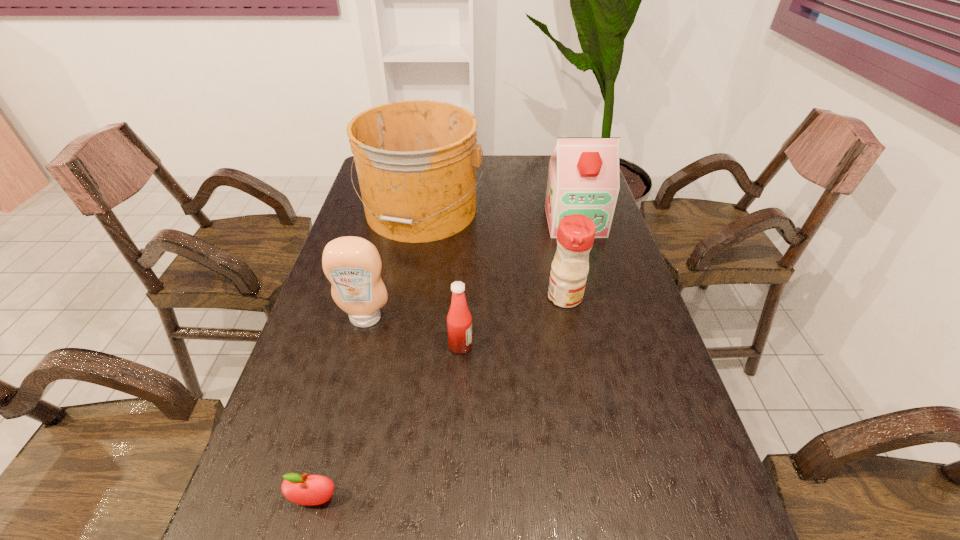
Locate an element on the screen. Image resolution: width=960 pixels, height=540 pixels. bucket is located at coordinates (416, 160).

What are the coordinates of `soya milk` in the screenshot? It's located at (583, 178).

At what (x,y) coordinates should I click in order to perform the action: click on the rightmost condiment. Please return your answer as a coordinate pair (x, y). Image resolution: width=960 pixels, height=540 pixels. Looking at the image, I should click on (575, 236).

The image size is (960, 540). I want to click on the leftmost condiment, so click(x=353, y=266).

Identify the location of the fifth farthest object. point(459,321).

Locate an element on the screen. Image resolution: width=960 pixels, height=540 pixels. the second condiment from left to right is located at coordinates (459, 321).

This screenshot has height=540, width=960. I want to click on apple, so click(309, 490).

Image resolution: width=960 pixels, height=540 pixels. Find the location of `the nearest object`. the nearest object is located at coordinates (309, 490).

Image resolution: width=960 pixels, height=540 pixels. Find the location of `vacant space located 0.090m on the front of the bucket`. vacant space located 0.090m on the front of the bucket is located at coordinates (411, 266).

Find the location of a particular element. vacant space located 0.120m with the cap open on the soya milk is located at coordinates (587, 262).